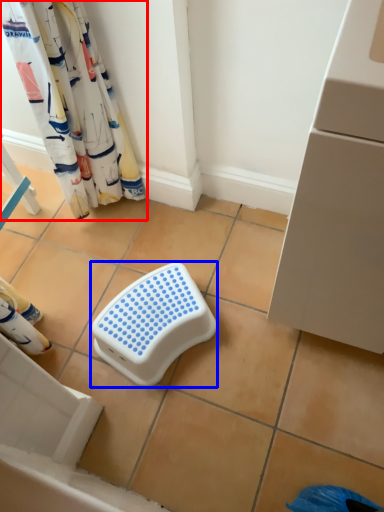
Question: Which object appears closest to the camera in this image, curtain (highlighted by a red box) or step stool (highlighted by a blue box)?

Choices:
 (A) curtain
 (B) step stool

Answer: (A)